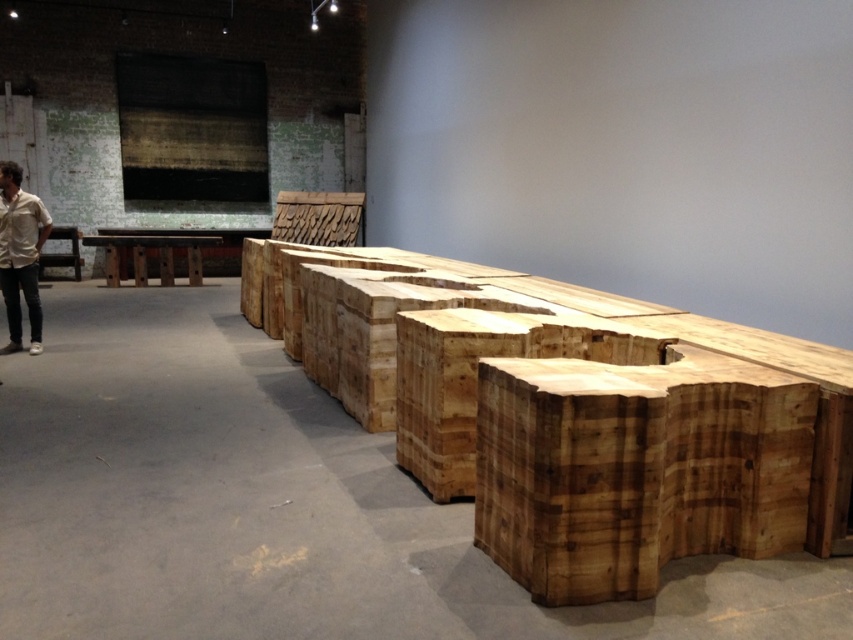
Is natural wood bench at center below white shirt at left?

Yes.

Is natural wood bench at center thinner than white shirt at left?

No, natural wood bench at center is not thinner than white shirt at left.

Where is `natural wood bench at center`? This screenshot has width=853, height=640. natural wood bench at center is located at coordinates (570, 412).

Where is `natural wood bench at center`? This screenshot has width=853, height=640. natural wood bench at center is located at coordinates (570, 412).

Can you confirm if natural wood bench at center is positioned below natural wood table at center?

Yes.

Does point (558, 595) come closer to viewer compared to point (132, 268)?

Yes, point (558, 595) is in front of point (132, 268).

Is point (515, 310) less distant than point (106, 257)?

Yes, it is.

Locate an element on the screen. natural wood bench at center is located at coordinates (570, 412).

Who is shorter, white shirt at left or natural wood table at center?

With less height is natural wood table at center.

Does white shirt at left have a lesser width compared to natural wood table at center?

Indeed, white shirt at left has a lesser width compared to natural wood table at center.

Who is more forward, [19,193] or [167,250]?

Positioned in front is point [19,193].

What are the coordinates of `white shirt at left` in the screenshot? It's located at point(20,253).